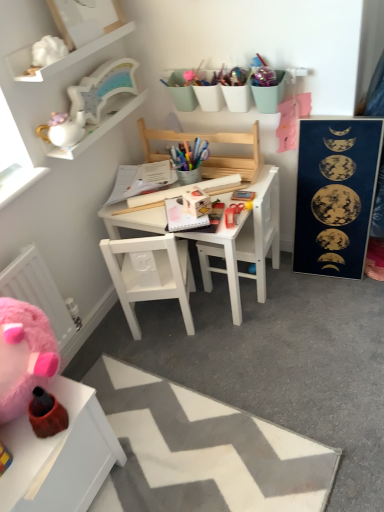
The width and height of the screenshot is (384, 512). What are the coordinates of `vacant space underneath white zigzag rug at lower center (from a real-world perspective)` in the screenshot? It's located at (195, 458).